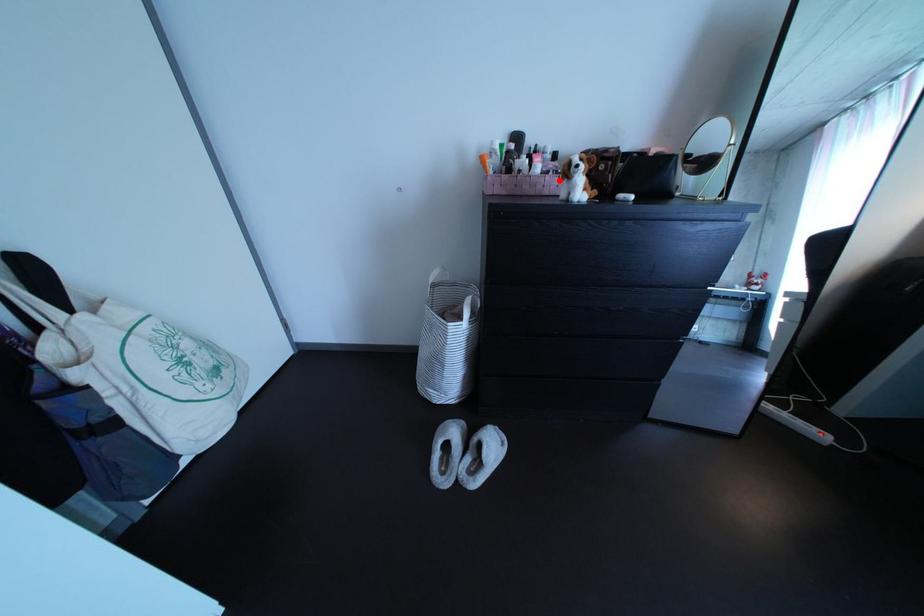
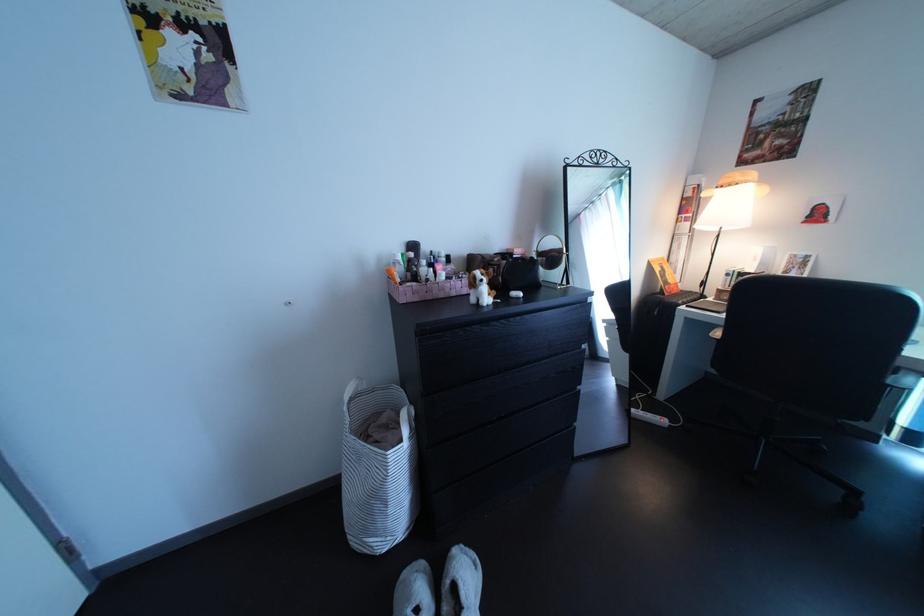
Locate, in the second image, the point that corresponds to the highlighted location in the first image.

(464, 286)